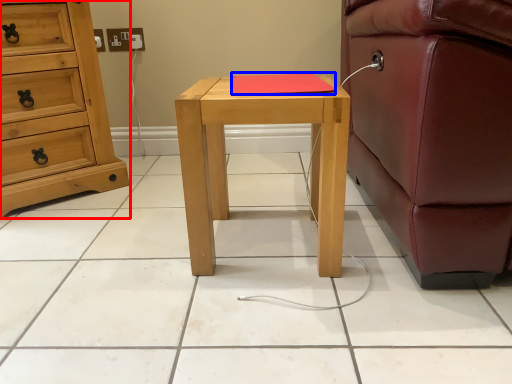
Question: Which point is closer to the camera, chest of drawers (highlighted by a red box) or pad (highlighted by a blue box)?

Choices:
 (A) chest of drawers
 (B) pad

Answer: (B)